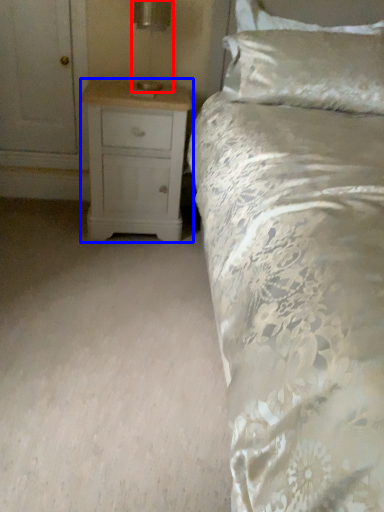
Question: Which of the following is the farthest to the observer, table lamp (highlighted by a red box) or chest of drawers (highlighted by a blue box)?

Choices:
 (A) table lamp
 (B) chest of drawers

Answer: (A)